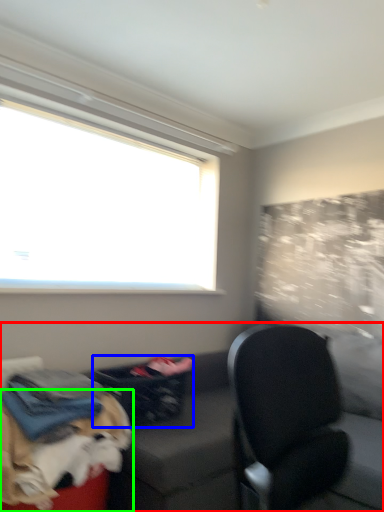
Question: Which is farther away from studio couch (highlighted by a red box)? laundry basket (highlighted by a blue box) or dog (highlighted by a green box)?

Choices:
 (A) laundry basket
 (B) dog

Answer: (A)